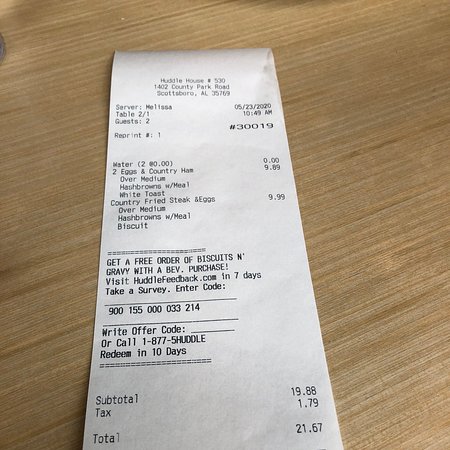
Where is `right side of table`? The image size is (450, 450). right side of table is located at coordinates (443, 233), (440, 344).